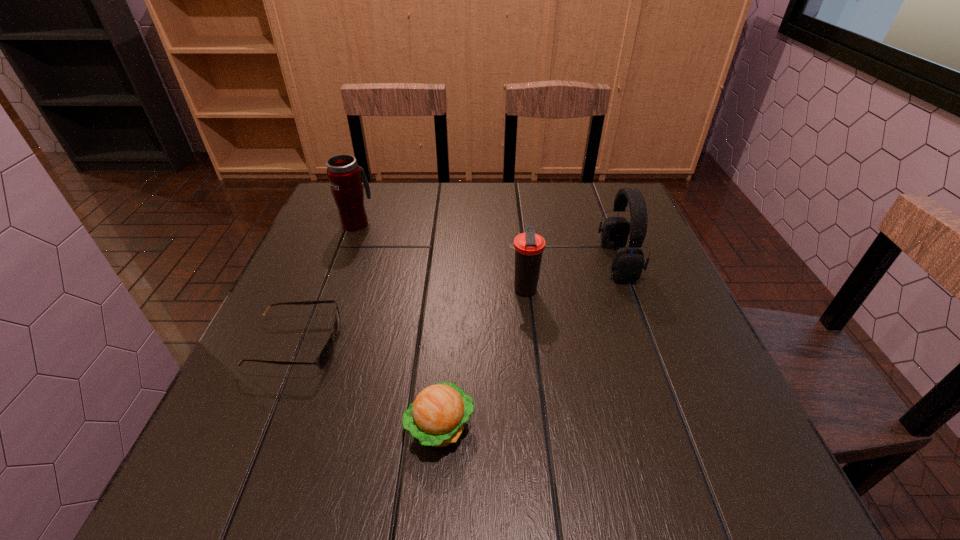
Locate an element on the screen. The height and width of the screenshot is (540, 960). free space located 0.050m on the headband of the rightmost object is located at coordinates (581, 261).

Locate an element on the screen. free space located 0.310m on the headband of the rightmost object is located at coordinates (475, 261).

Locate an element on the screen. The image size is (960, 540). free space located on the side with the handle of the left thermos bottle is located at coordinates (368, 194).

This screenshot has width=960, height=540. I want to click on free spot located on the side with the handle of the left thermos bottle, so click(372, 183).

Where is `vacant space located on the side with the handle of the left thermos bottle`? The height and width of the screenshot is (540, 960). vacant space located on the side with the handle of the left thermos bottle is located at coordinates 366,197.

Where is `free spot located 0.250m on the back of the right thermos bottle`? This screenshot has width=960, height=540. free spot located 0.250m on the back of the right thermos bottle is located at coordinates (516, 220).

At what (x,y) coordinates should I click in order to perform the action: click on vacant space located on the right of the nearest object. Please return your answer as a coordinate pair (x, y). This screenshot has height=540, width=960. Looking at the image, I should click on (551, 427).

The height and width of the screenshot is (540, 960). In order to click on free space located on the lenses of the fourth farthest object in this screenshot , I will do `click(363, 345)`.

Locate an element on the screen. The width and height of the screenshot is (960, 540). object positioned at the far edge is located at coordinates (344, 175).

Where is `object present at the near edge`? object present at the near edge is located at coordinates (437, 417).